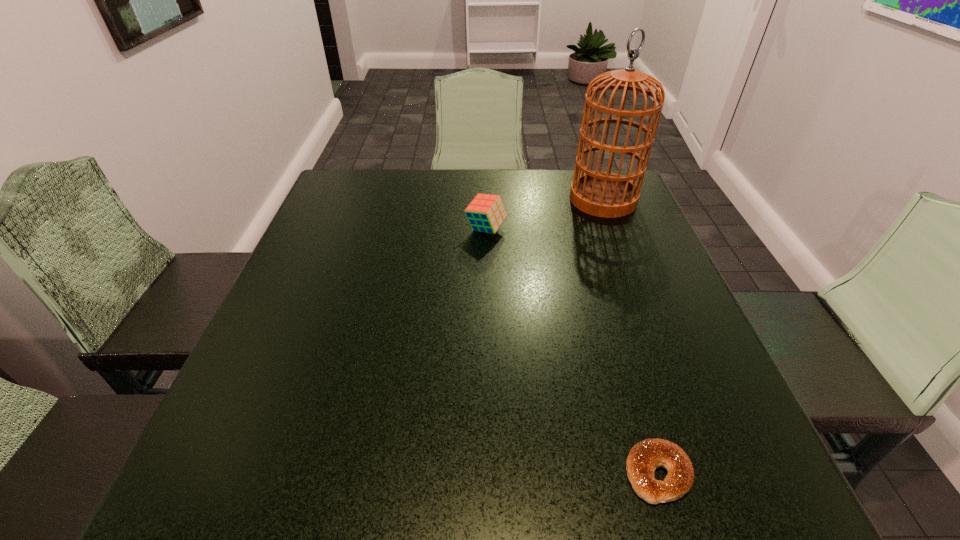
Locate an element on the screen. This screenshot has height=540, width=960. the closest object to the shortest object is located at coordinates (486, 213).

Select which object appears as the second closest to the bagel. Please provide its 2D coordinates. Your answer should be formatted as a tuple, i.e. [(x, y)], where the tuple contains the x and y coordinates of a point satisfying the conditions above.

[(603, 194)]

This screenshot has height=540, width=960. What are the coordinates of `free spot that satisfies the following two spatial constraints: 1. on the front side of the nearest object; 2. on the left side of the cube` in the screenshot? It's located at (491, 473).

Locate an element on the screen. The width and height of the screenshot is (960, 540). vacant space that satisfies the following two spatial constraints: 1. on the back side of the nearest object; 2. on the right side of the farthest object is located at coordinates (576, 199).